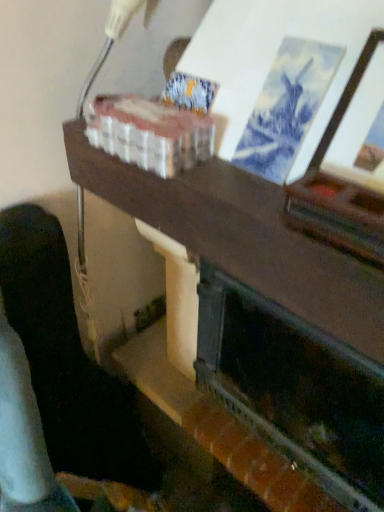
Question: Is dark wood table at center situated inside dark wood shelf at lower left or outside?

Choices:
 (A) inside
 (B) outside

Answer: (B)

Question: From a real-world perspective, is dark wood table at center positioned above or below dark wood shelf at lower left?

Choices:
 (A) above
 (B) below

Answer: (A)

Question: Considering the real-world distances, which object is closest to the dark wood shelf at lower left?

Choices:
 (A) dark wood table at center
 (B) dark green painted wood fireplace at center

Answer: (A)

Question: Which object is positioned closest to the dark wood shelf at lower left?

Choices:
 (A) dark green painted wood fireplace at center
 (B) dark wood table at center

Answer: (B)